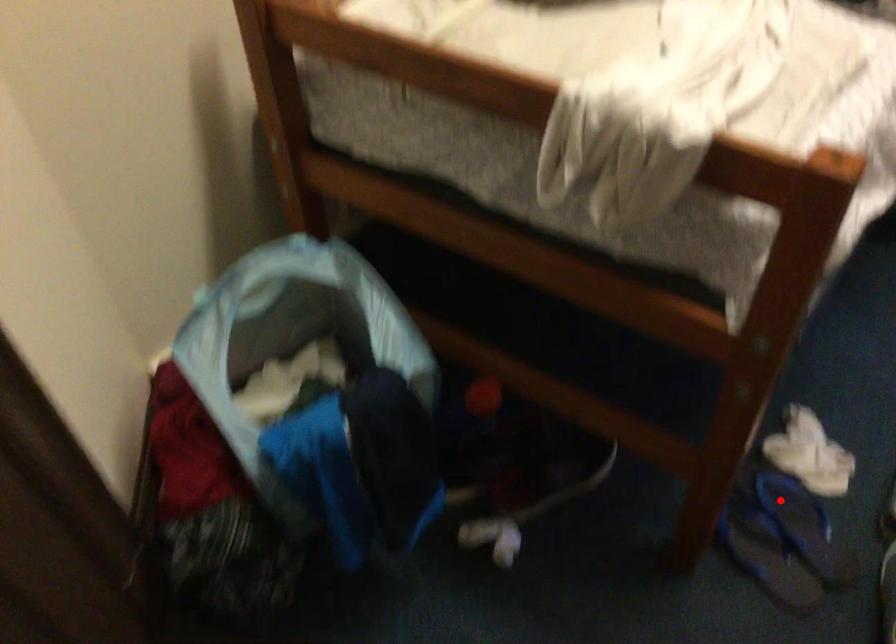
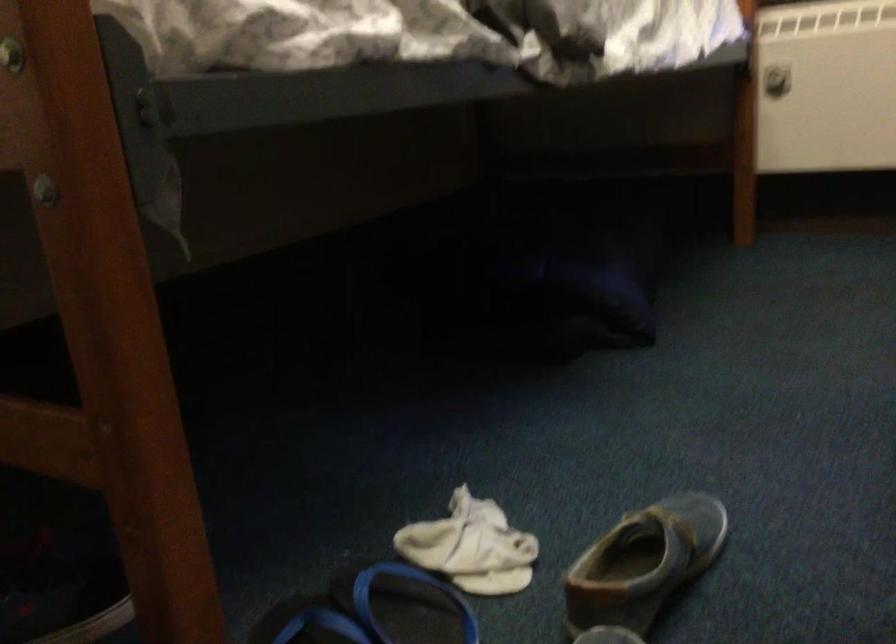
Question: I am providing you with two images of the same scene from different viewpoints. A red point is marked on the first image. Can you still see the location of the red point in image 2?

Choices:
 (A) Yes
 (B) No

Answer: (A)